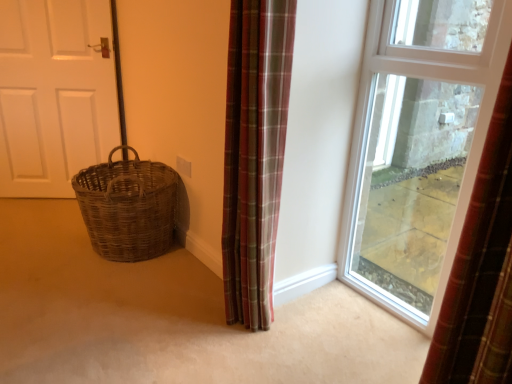
Question: From a real-world perspective, is plaid fabric curtain at center on white matte door at left?

Choices:
 (A) yes
 (B) no

Answer: (B)

Question: Is the surface of plaid fabric curtain at center in direct contact with white matte door at left?

Choices:
 (A) yes
 (B) no

Answer: (B)

Question: Is plaid fabric curtain at center shorter than white matte door at left?

Choices:
 (A) yes
 (B) no

Answer: (A)

Question: Does plaid fabric curtain at center have a larger size compared to white matte door at left?

Choices:
 (A) yes
 (B) no

Answer: (B)

Question: Is plaid fabric curtain at center facing towards white matte door at left?

Choices:
 (A) no
 (B) yes

Answer: (A)

Question: Is plaid fabric curtain at center in front of white matte door at left?

Choices:
 (A) no
 (B) yes

Answer: (B)

Question: Considering the relative positions of woven brown basket at lower left and plaid fabric curtain at center in the image provided, is woven brown basket at lower left to the right of plaid fabric curtain at center from the viewer's perspective?

Choices:
 (A) yes
 (B) no

Answer: (B)

Question: Can you confirm if woven brown basket at lower left is bigger than plaid fabric curtain at center?

Choices:
 (A) no
 (B) yes

Answer: (B)

Question: Is woven brown basket at lower left wider than plaid fabric curtain at center?

Choices:
 (A) yes
 (B) no

Answer: (A)

Question: Is woven brown basket at lower left closer to the viewer compared to plaid fabric curtain at center?

Choices:
 (A) no
 (B) yes

Answer: (A)

Question: Is woven brown basket at lower left facing away from plaid fabric curtain at center?

Choices:
 (A) yes
 (B) no

Answer: (B)

Question: Does woven brown basket at lower left come behind plaid fabric curtain at center?

Choices:
 (A) yes
 (B) no

Answer: (A)

Question: From a real-world perspective, is plaid fabric curtain at center positioned under clear glass window at center based on gravity?

Choices:
 (A) no
 (B) yes

Answer: (B)